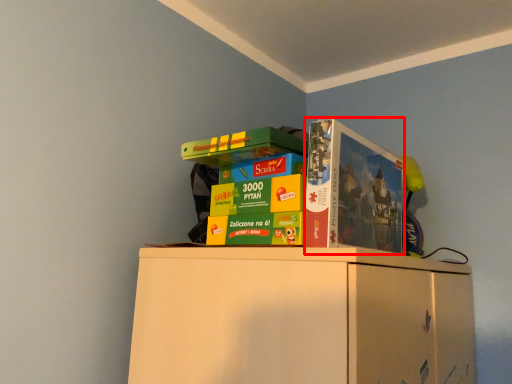
Question: From the image's perspective, where is paperback book (annotated by the red box) located in relation to collection in the image?

Choices:
 (A) above
 (B) below

Answer: (A)